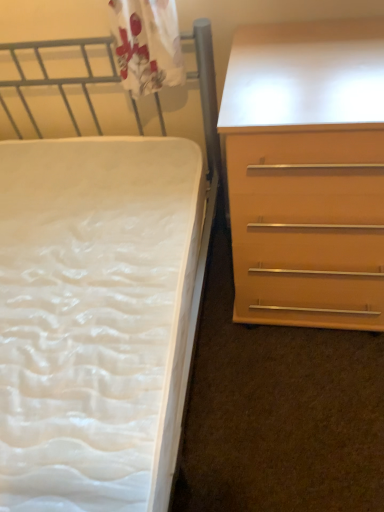
Question: Is light brown wood chest of drawers at right at the left side of white textured mattress at left?

Choices:
 (A) no
 (B) yes

Answer: (A)

Question: Is light brown wood chest of drawers at right aimed at white textured mattress at left?

Choices:
 (A) yes
 (B) no

Answer: (B)

Question: Can you confirm if light brown wood chest of drawers at right is smaller than white textured mattress at left?

Choices:
 (A) yes
 (B) no

Answer: (A)

Question: From the image's perspective, does light brown wood chest of drawers at right appear lower than white textured mattress at left?

Choices:
 (A) yes
 (B) no

Answer: (B)

Question: From the image's perspective, is light brown wood chest of drawers at right over white textured mattress at left?

Choices:
 (A) yes
 (B) no

Answer: (A)

Question: From a real-world perspective, is light brown wood chest of drawers at right physically below white textured mattress at left?

Choices:
 (A) yes
 (B) no

Answer: (A)

Question: Is the position of white textured mattress at left more distant than that of light brown wood chest of drawers at right?

Choices:
 (A) yes
 (B) no

Answer: (B)

Question: Is white textured mattress at left bigger than light brown wood chest of drawers at right?

Choices:
 (A) no
 (B) yes

Answer: (B)

Question: Is white textured mattress at left not within light brown wood chest of drawers at right?

Choices:
 (A) yes
 (B) no

Answer: (A)

Question: Is white textured mattress at left at the right side of light brown wood chest of drawers at right?

Choices:
 (A) yes
 (B) no

Answer: (B)

Question: Is light brown wood chest of drawers at right a part of white textured mattress at left?

Choices:
 (A) no
 (B) yes

Answer: (A)

Question: From the image's perspective, does white textured mattress at left appear lower than light brown wood chest of drawers at right?

Choices:
 (A) yes
 (B) no

Answer: (A)

Question: Is white textured mattress at left situated inside light brown wood chest of drawers at right or outside?

Choices:
 (A) outside
 (B) inside

Answer: (A)